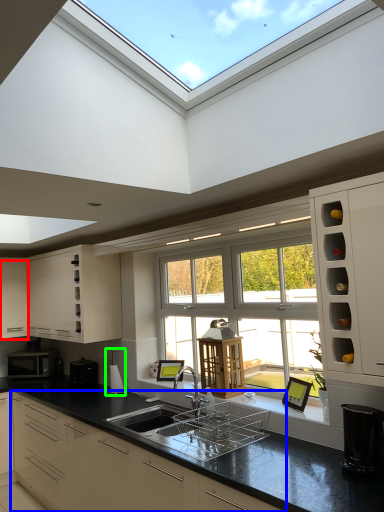
Question: Which object is the farthest from cabinetry (highlighted by a red box)? Choose among these: cabinetry (highlighted by a blue box) or appliance (highlighted by a green box).

Choices:
 (A) cabinetry
 (B) appliance

Answer: (A)